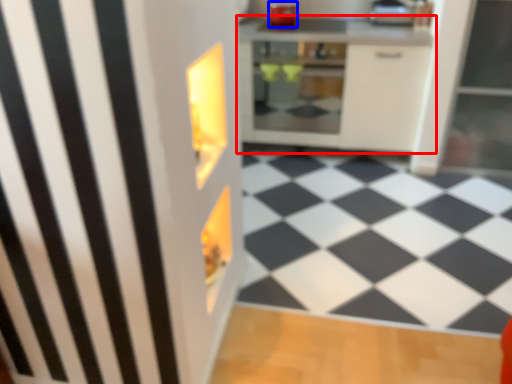
Question: Which point is further to the camera, cabinetry (highlighted by a red box) or appliance (highlighted by a blue box)?

Choices:
 (A) cabinetry
 (B) appliance

Answer: (B)